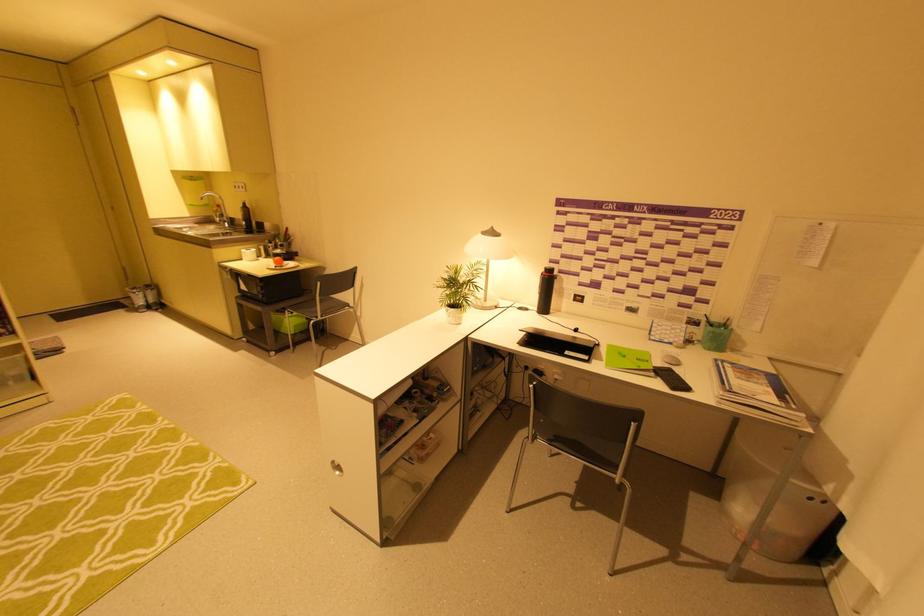
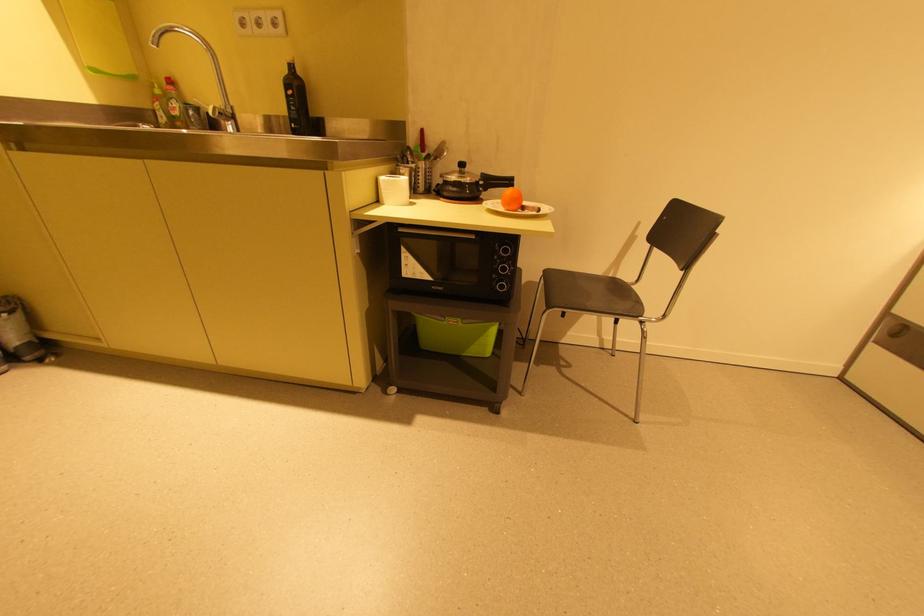
The point at (248,185) is marked in the first image. Where is the corresponding point in the second image?

(284, 15)